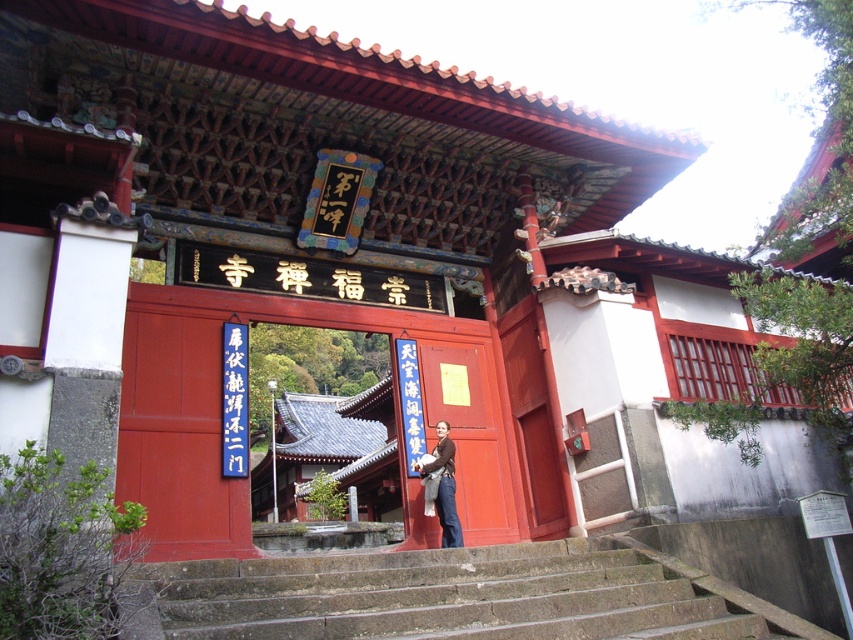
Question: Does concrete stairs at center have a greater width compared to brown leather jacket at center?

Choices:
 (A) no
 (B) yes

Answer: (B)

Question: Among these objects, which one is nearest to the camera?

Choices:
 (A) brown leather jacket at center
 (B) concrete stairs at center

Answer: (B)

Question: Can you confirm if matte wood door at center is positioned to the right of brown leather jacket at center?

Choices:
 (A) yes
 (B) no

Answer: (A)

Question: Which point appears closest to the camera in this image?

Choices:
 (A) (488, 556)
 (B) (440, 468)

Answer: (A)

Question: Considering the relative positions of matte wood door at center and brown leather jacket at center in the image provided, where is matte wood door at center located with respect to brown leather jacket at center?

Choices:
 (A) right
 (B) left

Answer: (A)

Question: Estimate the real-world distances between objects in this image. Which object is closer to the brown leather jacket at center?

Choices:
 (A) matte wood door at center
 (B) concrete stairs at center

Answer: (A)